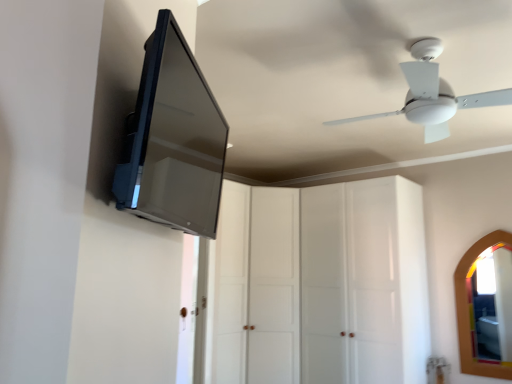
Question: From the image's perspective, is white plastic ceiling fan at upper right located above or below transparent glass cabinet at center, which is counted as the first glass door, starting from the left?

Choices:
 (A) above
 (B) below

Answer: (A)

Question: Considering the positions of white plastic ceiling fan at upper right and transparent glass cabinet at center, arranged as the 2th glass door when viewed from the right, in the image, is white plastic ceiling fan at upper right bigger or smaller than transparent glass cabinet at center, arranged as the 2th glass door when viewed from the right,?

Choices:
 (A) big
 (B) small

Answer: (B)

Question: Based on their relative distances, which object is farther from the white plastic ceiling fan at upper right?

Choices:
 (A) wooden-framed mirror at right
 (B) white glossy cabinet at center, marked as the 1th glass door in a right-to-left arrangement
 (C) satin black tv at upper left
 (D) transparent glass cabinet at center, arranged as the 2th glass door when viewed from the right

Answer: (D)

Question: Considering the real-world distances, which object is farthest from the white plastic ceiling fan at upper right?

Choices:
 (A) white glossy cabinet at center, marked as the 2th glass door in a left-to-right arrangement
 (B) satin black tv at upper left
 (C) transparent glass cabinet at center, which is counted as the first glass door, starting from the left
 (D) wooden-framed mirror at right

Answer: (C)